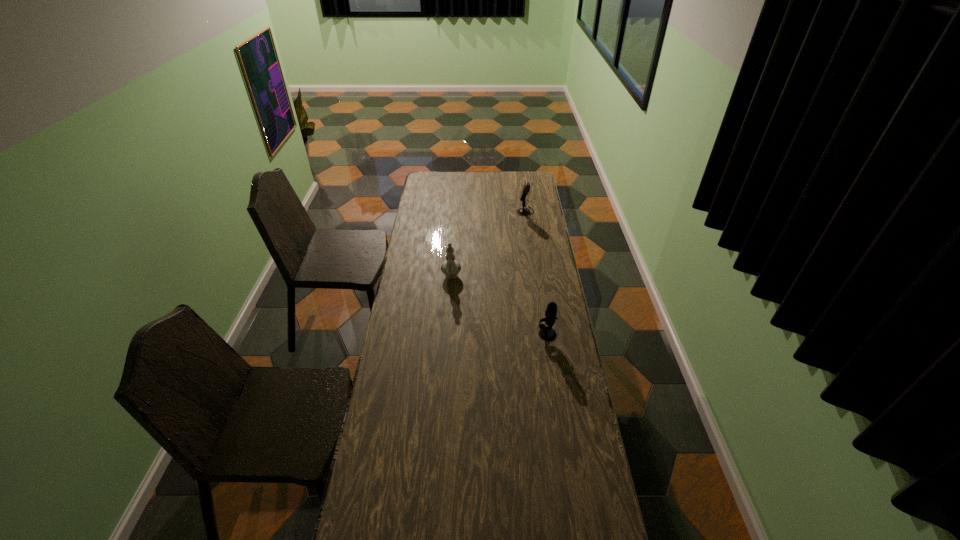
Find the location of a particular element. The image size is (960, 540). the leftmost object is located at coordinates (451, 268).

This screenshot has width=960, height=540. I want to click on the second nearest object, so click(451, 268).

This screenshot has height=540, width=960. In order to click on the farthest object in this screenshot , I will do `click(526, 187)`.

The width and height of the screenshot is (960, 540). In order to click on the nearer microphone in this screenshot , I will do `click(547, 333)`.

In order to click on vacant space located 0.080m at the spout of the chinaware in this screenshot , I will do `click(449, 298)`.

Locate an element on the screen. This screenshot has width=960, height=540. vacant region located 0.240m on the front-facing side of the farthest object is located at coordinates (474, 211).

The image size is (960, 540). In order to click on vacant position located 0.330m on the front-facing side of the farthest object in this screenshot , I will do `click(458, 211)`.

Locate an element on the screen. This screenshot has height=540, width=960. free space located on the front-facing side of the farthest object is located at coordinates (453, 211).

Identify the location of vacant space located 0.250m on the back of the nearest object. (540, 287).

Find the location of a particular element. This screenshot has height=540, width=960. blank space at the far edge of the desktop is located at coordinates [456, 189].